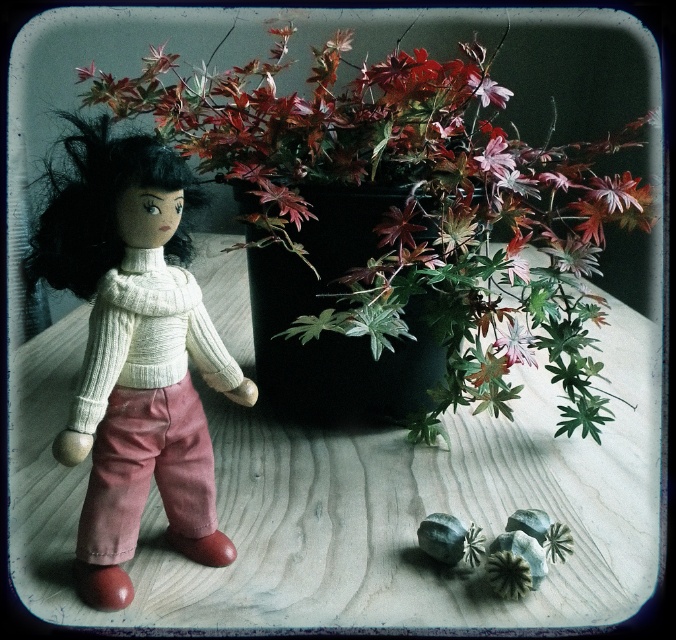
Question: From the image, what is the correct spatial relationship of wooden table at center in relation to silvery metallic flower at center?

Choices:
 (A) left
 (B) right

Answer: (A)

Question: Which of the following is the farthest from the observer?

Choices:
 (A) matte pink petal at upper center
 (B) silvery metallic flower at center
 (C) white knitted sweater at left
 (D) wooden table at center

Answer: (B)

Question: Among these points, which one is nearest to the camera?

Choices:
 (A) (473, 371)
 (B) (589, 442)
 (C) (508, 326)

Answer: (A)

Question: Which is nearer to the wooden table at center?

Choices:
 (A) matte pink petal at upper center
 (B) silvery metallic flower at center
 (C) leaves matte/black at left
 (D) matte white sweater at center

Answer: (C)

Question: Is matte white sweater at center positioned at the back of white knitted sweater at left?

Choices:
 (A) yes
 (B) no

Answer: (B)

Question: Is silvery metallic flower at center below matte pink petal at upper center?

Choices:
 (A) no
 (B) yes

Answer: (B)